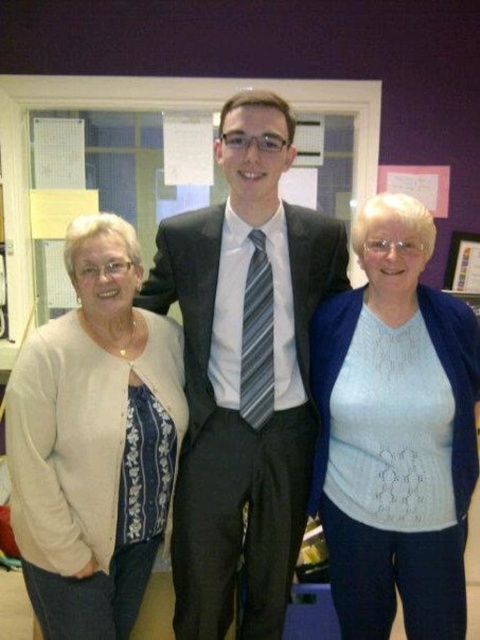
Based on the scene described, which clothing item is wider, the white knit sweater at center or the white knit cardigan at left?

The white knit sweater at center is wider than the white knit cardigan at left according to the description.

In the scene, there are a matte black suit at center and a white knit cardigan at left. Which one is positioned higher from the ground?

The matte black suit at center is located above the white knit cardigan at left, so it is positioned higher from the ground.

You are a photographer setting up for a group photo. You need to arrange the subjects so that the matte black suit at center and the white knit cardigan at left are visible. Based on their heights, which subject should stand closer to the back to avoid blocking the other?

The matte black suit at center is taller than the white knit cardigan at left, so the matte black suit at center should stand closer to the back to avoid blocking the shorter subject.